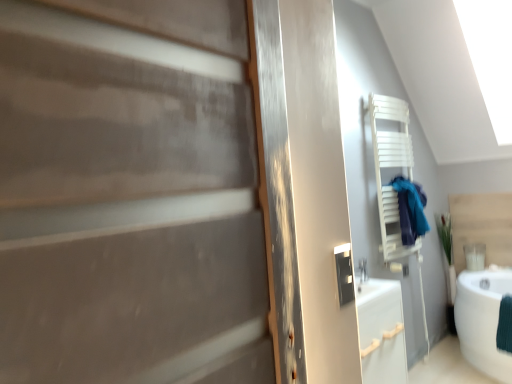
Question: Is blue fabric at right taller than white glossy bathtub at lower right?

Choices:
 (A) yes
 (B) no

Answer: (B)

Question: Is blue fabric at right oriented away from white glossy bathtub at lower right?

Choices:
 (A) no
 (B) yes

Answer: (A)

Question: Does blue fabric at right appear on the left side of white glossy bathtub at lower right?

Choices:
 (A) no
 (B) yes

Answer: (B)

Question: Does blue fabric at right turn towards white glossy bathtub at lower right?

Choices:
 (A) yes
 (B) no

Answer: (B)

Question: From a real-world perspective, is blue fabric at right below white glossy bathtub at lower right?

Choices:
 (A) yes
 (B) no

Answer: (B)

Question: From the image's perspective, is blue fabric at right above white glossy bathtub at lower right?

Choices:
 (A) yes
 (B) no

Answer: (A)

Question: From a real-world perspective, does white glossy bathtub at lower right stand above blue fabric at right?

Choices:
 (A) no
 (B) yes

Answer: (A)

Question: Is there a large distance between white glossy bathtub at lower right and blue fabric at right?

Choices:
 (A) yes
 (B) no

Answer: (B)

Question: Is white glossy bathtub at lower right bigger than blue fabric at right?

Choices:
 (A) no
 (B) yes

Answer: (B)

Question: From the image's perspective, is white glossy bathtub at lower right located above blue fabric at right?

Choices:
 (A) yes
 (B) no

Answer: (B)

Question: Does white glossy bathtub at lower right have a lesser width compared to blue fabric at right?

Choices:
 (A) no
 (B) yes

Answer: (A)

Question: Is white glossy bathtub at lower right further to the viewer compared to blue fabric at right?

Choices:
 (A) yes
 (B) no

Answer: (B)

Question: In terms of size, does white glossy bathtub at lower right appear bigger or smaller than blue fabric at right?

Choices:
 (A) small
 (B) big

Answer: (B)